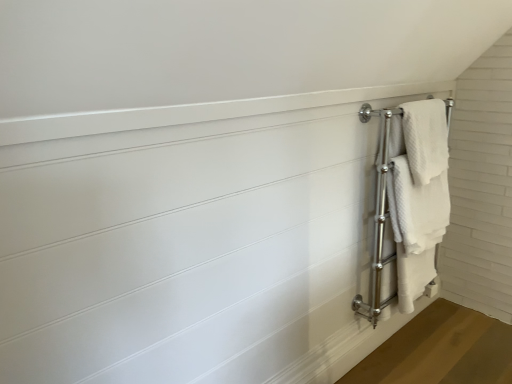
Question: From the image's perspective, does white textured towel at right, the 1th bath towel in the top-to-bottom sequence, appear higher than white textured towel at right?

Choices:
 (A) no
 (B) yes

Answer: (B)

Question: From the image's perspective, is white textured towel at right, the 1th bath towel in the top-to-bottom sequence, beneath white textured towel at right?

Choices:
 (A) no
 (B) yes

Answer: (A)

Question: Is white textured towel at right, the 1th bath towel in the top-to-bottom sequence, further to the viewer compared to white textured towel at right?

Choices:
 (A) yes
 (B) no

Answer: (B)

Question: Does white textured towel at right, the second bath towel ordered from the bottom, come in front of white textured towel at right?

Choices:
 (A) yes
 (B) no

Answer: (A)

Question: Considering the relative positions of white textured towel at right, the second bath towel ordered from the bottom, and white textured towel at right in the image provided, is white textured towel at right, the second bath towel ordered from the bottom, to the right of white textured towel at right from the viewer's perspective?

Choices:
 (A) yes
 (B) no

Answer: (B)

Question: Would you say white textured towel at right is inside or outside white textured towel at right, the 1th bath towel in the top-to-bottom sequence?

Choices:
 (A) outside
 (B) inside

Answer: (A)

Question: Is point (395, 200) closer or farther from the camera than point (426, 152)?

Choices:
 (A) closer
 (B) farther

Answer: (A)

Question: Is white textured towel at right wider or thinner than white textured towel at right, the second bath towel ordered from the bottom?

Choices:
 (A) wide
 (B) thin

Answer: (B)

Question: In terms of size, does white textured towel at right appear bigger or smaller than white textured towel at right, the second bath towel ordered from the bottom?

Choices:
 (A) big
 (B) small

Answer: (A)

Question: From the image's perspective, is white textured towel at right located above or below white textured towel at right, which is counted as the first bath towel, starting from the bottom?

Choices:
 (A) below
 (B) above

Answer: (B)

Question: Is white textured towel at right bigger or smaller than white textured towel at right, acting as the 2th bath towel starting from the top?

Choices:
 (A) big
 (B) small

Answer: (B)

Question: Considering the positions of white textured towel at right and white textured towel at right, acting as the 2th bath towel starting from the top, in the image, is white textured towel at right taller or shorter than white textured towel at right, acting as the 2th bath towel starting from the top,?

Choices:
 (A) short
 (B) tall

Answer: (A)

Question: Is white textured towel at right to the left or to the right of white textured towel at right, which is counted as the first bath towel, starting from the bottom, in the image?

Choices:
 (A) right
 (B) left

Answer: (A)

Question: Based on their sizes in the image, would you say white textured towel at right, which is counted as the first bath towel, starting from the bottom, is bigger or smaller than white textured towel at right?

Choices:
 (A) small
 (B) big

Answer: (B)

Question: Is white textured towel at right, acting as the 2th bath towel starting from the top, inside the boundaries of white textured towel at right, or outside?

Choices:
 (A) outside
 (B) inside

Answer: (A)